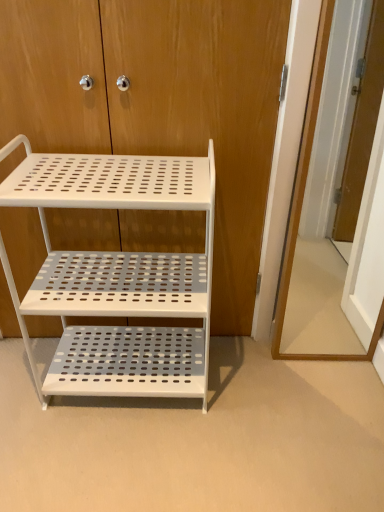
Identify the location of free space between white perforated metal shelf at center and wooden door at right. (263, 377).